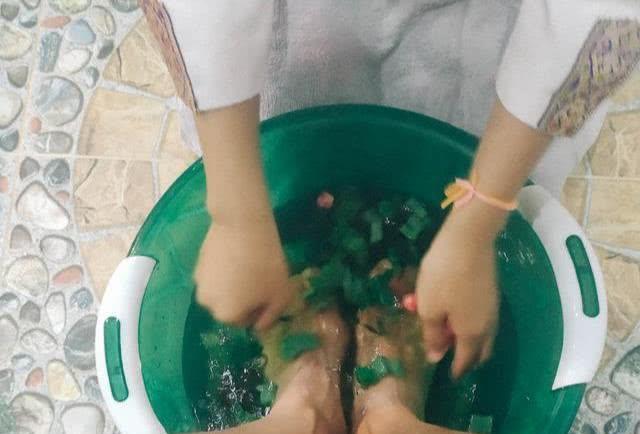
Where is `bowl`? bowl is located at coordinates (548, 313), (166, 336), (320, 141).